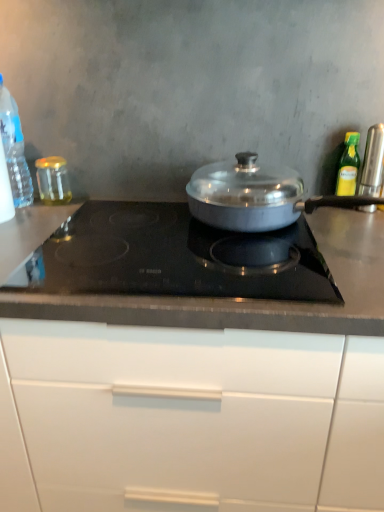
Question: From their relative heights in the image, would you say satin silver pan at center, the 3th kitchen appliance when ordered from right to left, is taller or shorter than white glossy cabinet at center?

Choices:
 (A) short
 (B) tall

Answer: (A)

Question: Considering their positions, is satin silver pan at center, which is the 3th kitchen appliance in left-to-right order, located in front of or behind white glossy cabinet at center?

Choices:
 (A) front
 (B) behind

Answer: (B)

Question: Based on their relative distances, which object is nearer to the translucent glass jar at left, placed as the 4th kitchen appliance when sorted from right to left?

Choices:
 (A) green glass bottle at upper right, the fourth kitchen appliance positioned from the left
 (B) satin silver canister at right, which ranks as the 1th kitchen appliance in right-to-left order
 (C) clear plastic bottle at left, the fifth kitchen appliance from the right
 (D) satin silver pan at center, which is the 3th kitchen appliance in left-to-right order
 (E) white glossy cabinet at center

Answer: (C)

Question: Which is farther from the green glass bottle at upper right, which is counted as the 2th kitchen appliance, starting from the right?

Choices:
 (A) satin silver canister at right, which ranks as the 1th kitchen appliance in right-to-left order
 (B) translucent glass jar at left, placed as the 4th kitchen appliance when sorted from right to left
 (C) clear plastic bottle at left, the 1th kitchen appliance viewed from the left
 (D) black glass cooktop at center
 (E) satin silver pan at center, the 3th kitchen appliance when ordered from right to left

Answer: (C)